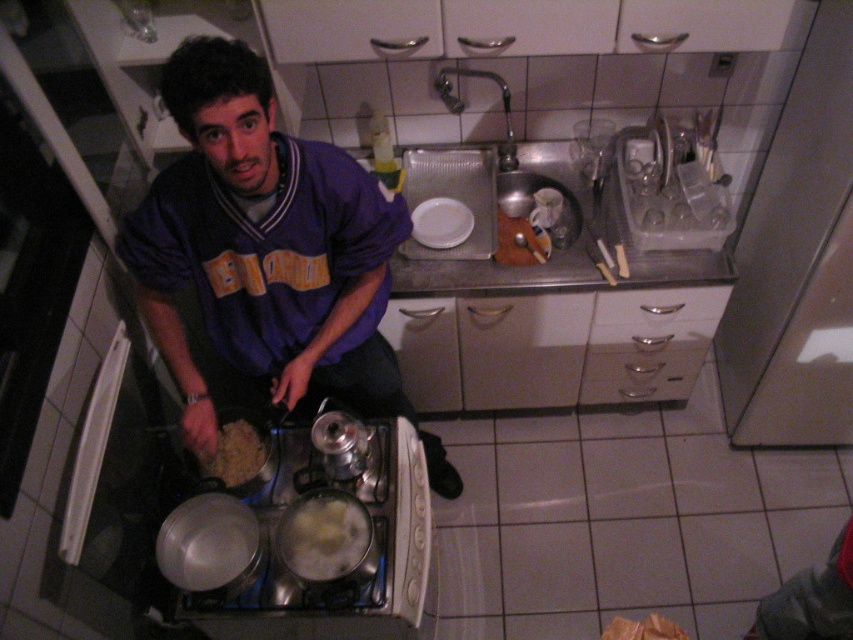
Question: Is white creamy food at lower center bigger than white matte plate at center?

Choices:
 (A) no
 (B) yes

Answer: (A)

Question: Does brown matte rice at lower center have a greater width compared to white matte plate at center?

Choices:
 (A) yes
 (B) no

Answer: (B)

Question: Which object appears farthest from the camera in this image?

Choices:
 (A) brown matte rice at lower center
 (B) white creamy food at lower center

Answer: (A)

Question: Among these objects, which one is nearest to the camera?

Choices:
 (A) white creamy food at lower center
 (B) brown matte rice at lower center

Answer: (A)

Question: Does white creamy food at lower center lie behind white matte plate at center?

Choices:
 (A) yes
 (B) no

Answer: (B)

Question: Which object is closer to the camera taking this photo?

Choices:
 (A) white creamy food at lower center
 (B) white matte plate at center
 (C) brown matte rice at lower center
 (D) purple jersey at center

Answer: (D)